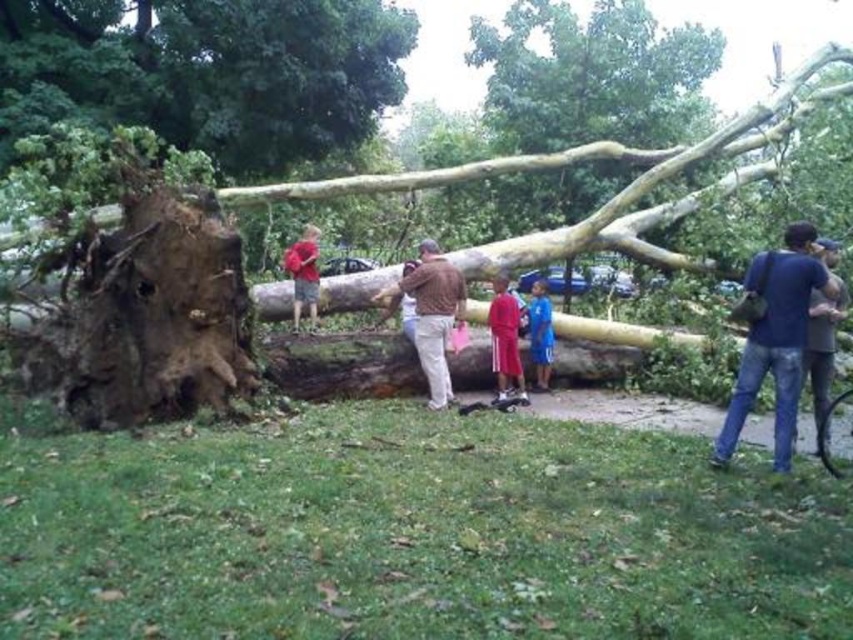
You are a park visitor who wants to take a photo of the fallen tree. You notice two people nearby wearing the matte red shirt at center and the blue cotton shirt at center. Which person should you ask for help holding the camera since they are closer to you?

You should ask the matte red shirt at center for help because they are closer to the viewer than the blue cotton shirt at center.

You are a park visitor who wants to walk from the brown rough bark at upper left to the smooth brown log at center. Which direction should you move relative to the log?

You should move to the right relative to the smooth brown log at center because the brown rough bark at upper left is located to the left of the log.